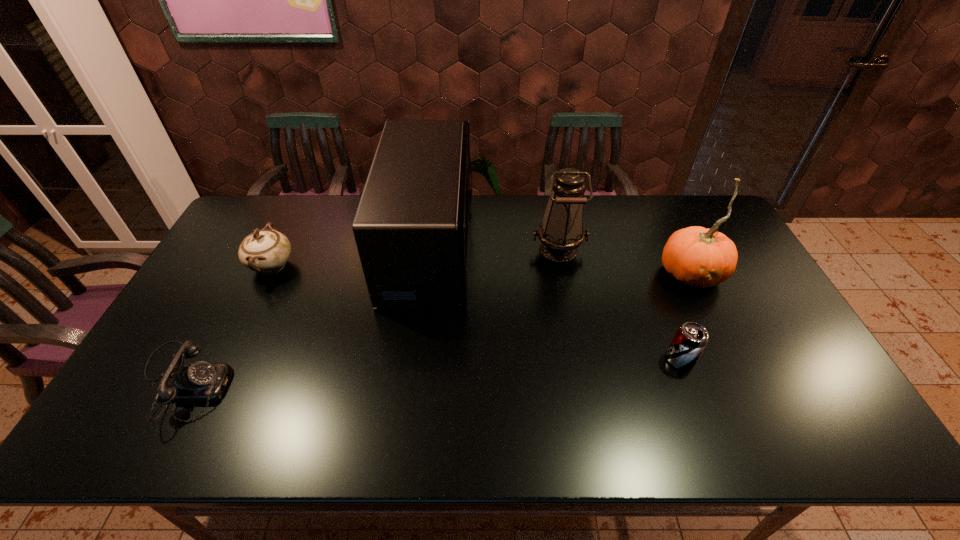
Identify the location of free region at the left edge of the desktop. (216, 290).

At what (x,y) coordinates should I click in order to perform the action: click on vacant space at the right edge. Please return your answer as a coordinate pair (x, y). The height and width of the screenshot is (540, 960). Looking at the image, I should click on (747, 281).

Where is `blank space at the far right corner of the desktop`? The height and width of the screenshot is (540, 960). blank space at the far right corner of the desktop is located at coordinates (699, 211).

Identify the location of vacant point located between the third object from right to left and the soda can. (619, 305).

Locate an element on the screen. This screenshot has width=960, height=540. vacant region between the shortest object and the fourth object from left to right is located at coordinates (370, 316).

What are the coordinates of `blank region between the shortest object and the microwave_oven` in the screenshot? It's located at (305, 314).

This screenshot has height=540, width=960. Identify the location of free area in between the third shortest object and the pumpkin. (481, 269).

The height and width of the screenshot is (540, 960). What are the coordinates of `vacant space that's between the shortest object and the soda can` in the screenshot? It's located at (431, 371).

At what (x,y) coordinates should I click in order to perform the action: click on vacant area between the chinaware and the pumpkin. Please return your answer as a coordinate pair (x, y). This screenshot has width=960, height=540. Looking at the image, I should click on (481, 269).

This screenshot has height=540, width=960. Identify the location of unoccupied area between the shortest object and the pumpkin. (436, 328).